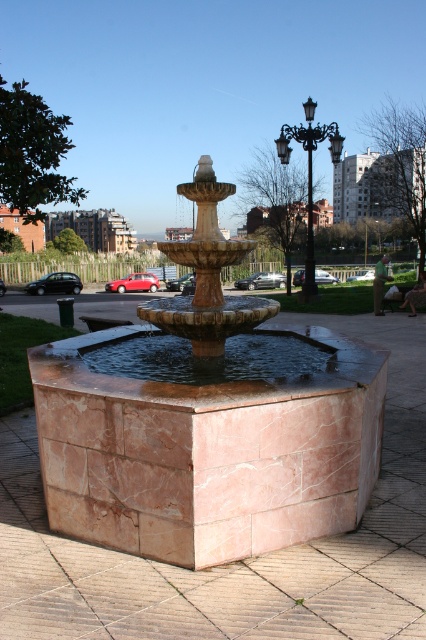
Who is shorter, pink marble fountain at center or black wrought iron streetlight at upper right?

Standing shorter between the two is pink marble fountain at center.

Does pink marble fountain at center appear on the left side of black wrought iron streetlight at upper right?

Correct, you'll find pink marble fountain at center to the left of black wrought iron streetlight at upper right.

Where is `pink marble fountain at center`? pink marble fountain at center is located at coordinates (207, 426).

Can you confirm if marble fountain at center is positioned above black wrought iron streetlight at upper right?

Incorrect, marble fountain at center is not positioned above black wrought iron streetlight at upper right.

What do you see at coordinates (201, 305) in the screenshot? The width and height of the screenshot is (426, 640). I see `marble fountain at center` at bounding box center [201, 305].

Image resolution: width=426 pixels, height=640 pixels. In order to click on marble fountain at center in this screenshot , I will do `click(201, 305)`.

Does pink marble fountain at center have a greater height compared to marble fountain at center?

Yes, pink marble fountain at center is taller than marble fountain at center.

Can you confirm if pink marble fountain at center is thinner than marble fountain at center?

No.

This screenshot has height=640, width=426. In order to click on pink marble fountain at center in this screenshot , I will do `click(207, 426)`.